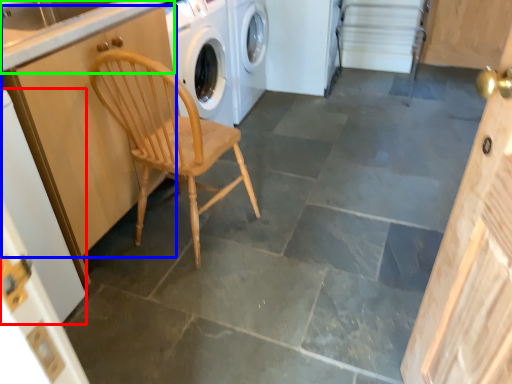
Question: Which object is positioned closest to door (highlighted by a red box)? Select from cabinetry (highlighted by a blue box) and counter top (highlighted by a green box).

Choices:
 (A) cabinetry
 (B) counter top

Answer: (A)